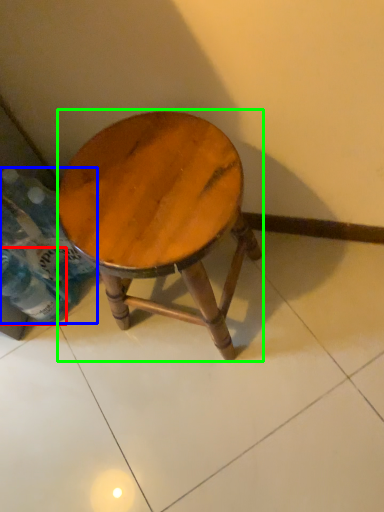
Question: Which object is the farthest from bottle (highlighted by a red box)? Choose among these: bottle (highlighted by a blue box) or stool (highlighted by a green box).

Choices:
 (A) bottle
 (B) stool

Answer: (B)